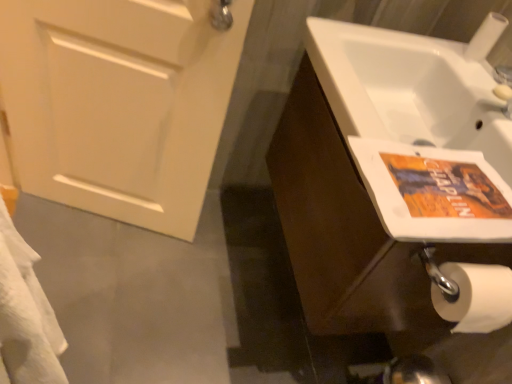
Question: Is orange paper flyer at right inside brown wood cabinet at right?

Choices:
 (A) no
 (B) yes

Answer: (A)

Question: Would you say brown wood cabinet at right is a long distance from orange paper flyer at right?

Choices:
 (A) yes
 (B) no

Answer: (B)

Question: Are brown wood cabinet at right and orange paper flyer at right beside each other?

Choices:
 (A) no
 (B) yes

Answer: (A)

Question: Is brown wood cabinet at right positioned with its back to orange paper flyer at right?

Choices:
 (A) no
 (B) yes

Answer: (A)

Question: From the image's perspective, would you say brown wood cabinet at right is positioned over orange paper flyer at right?

Choices:
 (A) yes
 (B) no

Answer: (A)

Question: Based on their sizes in the image, would you say orange paper flyer at right is bigger or smaller than white matte door at left?

Choices:
 (A) small
 (B) big

Answer: (A)

Question: Does point (361, 150) appear closer or farther from the camera than point (168, 76)?

Choices:
 (A) closer
 (B) farther

Answer: (A)

Question: From the image's perspective, is orange paper flyer at right above or below white matte door at left?

Choices:
 (A) above
 (B) below

Answer: (B)

Question: Visually, is orange paper flyer at right positioned to the left or to the right of white matte door at left?

Choices:
 (A) right
 (B) left

Answer: (A)

Question: From the image's perspective, relative to orange paper flyer at right, is white matte door at left above or below?

Choices:
 (A) below
 (B) above

Answer: (B)

Question: Is white matte door at left inside the boundaries of orange paper flyer at right, or outside?

Choices:
 (A) inside
 (B) outside

Answer: (B)

Question: Considering the positions of white matte door at left and orange paper flyer at right in the image, is white matte door at left wider or thinner than orange paper flyer at right?

Choices:
 (A) wide
 (B) thin

Answer: (B)

Question: From a real-world perspective, is white matte door at left above or below orange paper flyer at right?

Choices:
 (A) above
 (B) below

Answer: (B)

Question: From the image's perspective, relative to brown wood cabinet at right, is orange paper flyer at right above or below?

Choices:
 (A) above
 (B) below

Answer: (B)

Question: Is orange paper flyer at right in front of or behind brown wood cabinet at right in the image?

Choices:
 (A) behind
 (B) front

Answer: (B)